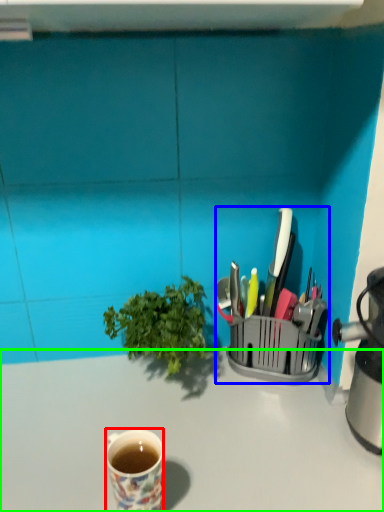
Question: Considering the real-world distances, which object is closest to coffee cup (highlighted by a red box)? appliance (highlighted by a blue box) or desk (highlighted by a green box).

Choices:
 (A) appliance
 (B) desk

Answer: (B)